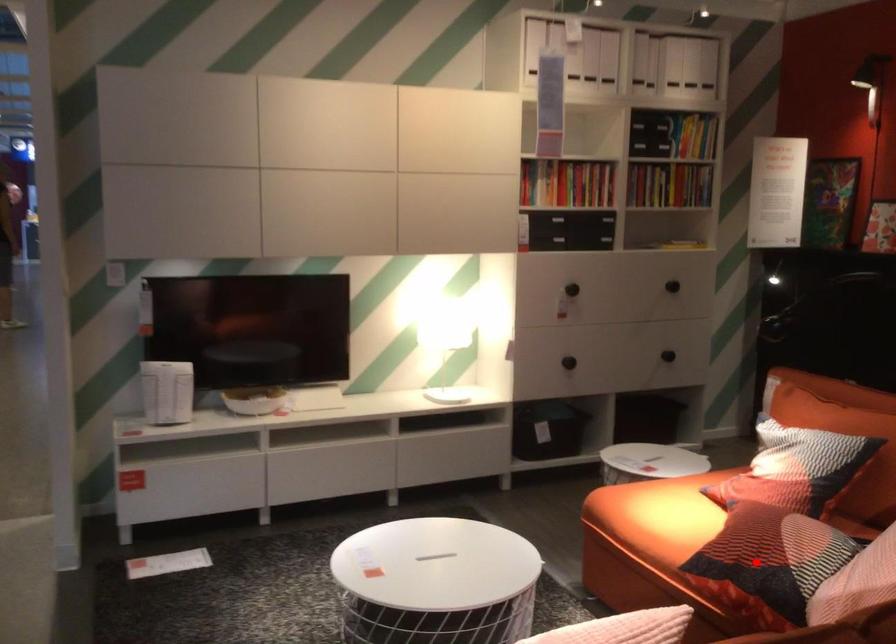
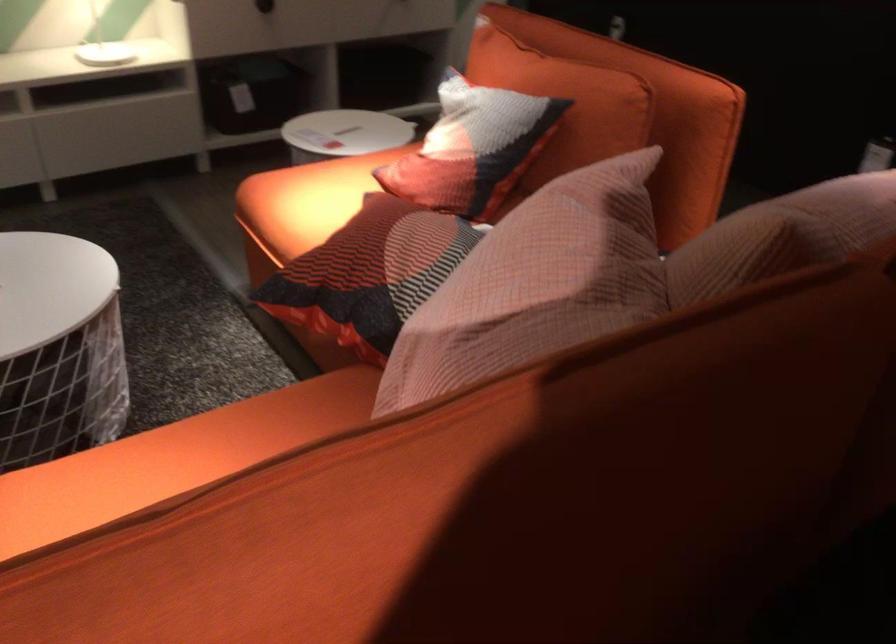
Find the pixel in the second image that matches the highlighted location in the first image.

(369, 274)